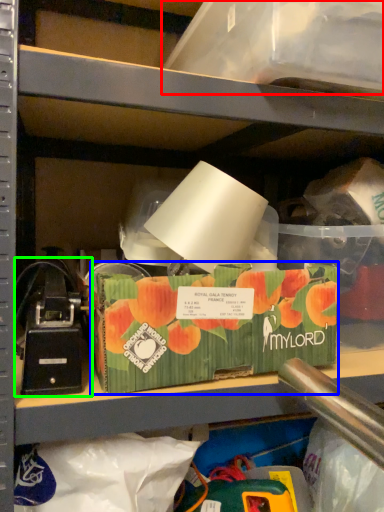
Question: Based on their relative distances, which object is nearer to storage box (highlighted by a red box)? Choose from storage box (highlighted by a blue box) and toy (highlighted by a green box).

Choices:
 (A) storage box
 (B) toy

Answer: (A)